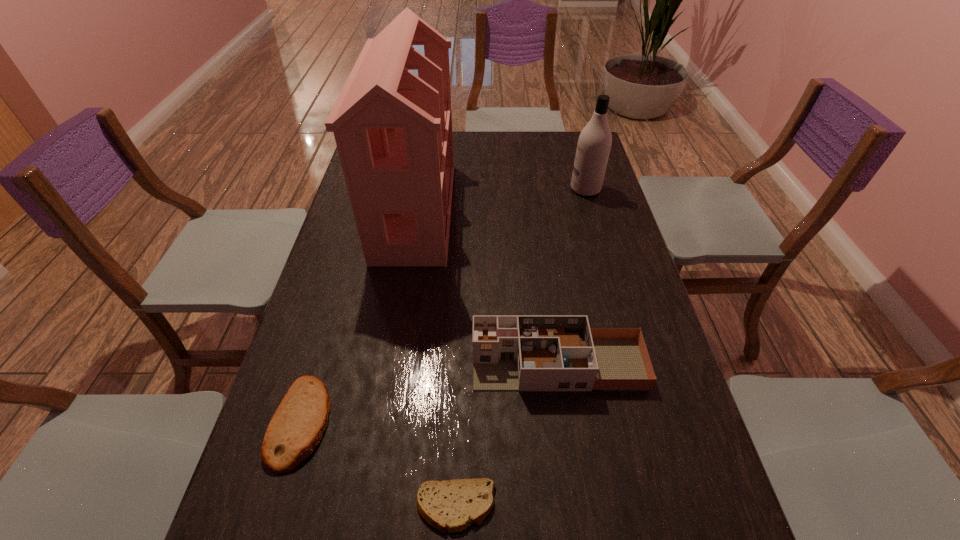
Where is `vacant position located 0.080m on the front-facing side of the fourth shortest object`? The image size is (960, 540). vacant position located 0.080m on the front-facing side of the fourth shortest object is located at coordinates (547, 189).

Where is `free space located on the front-facing side of the fourth shortest object`? The image size is (960, 540). free space located on the front-facing side of the fourth shortest object is located at coordinates [485, 189].

What are the coordinates of `free region located 0.380m on the front-facing side of the fourth shortest object` in the screenshot? It's located at (462, 189).

Locate an element on the screen. vacant space located 0.310m at the entrance of the third tallest object is located at coordinates (343, 363).

This screenshot has width=960, height=540. I want to click on free space located at the entrance of the third tallest object, so point(368,363).

Locate an element on the screen. vacant space situated at the entrance of the third tallest object is located at coordinates (322, 363).

Locate an element on the screen. vacant space situated on the back of the fourth tallest object is located at coordinates (339, 296).

Where is `blank space located 0.330m on the right of the shortest object`? The height and width of the screenshot is (540, 960). blank space located 0.330m on the right of the shortest object is located at coordinates (671, 507).

Find the location of a particular element. This screenshot has height=540, width=960. dollhouse situated at the left edge is located at coordinates [393, 130].

The height and width of the screenshot is (540, 960). I want to click on pita bread present at the left edge, so click(295, 430).